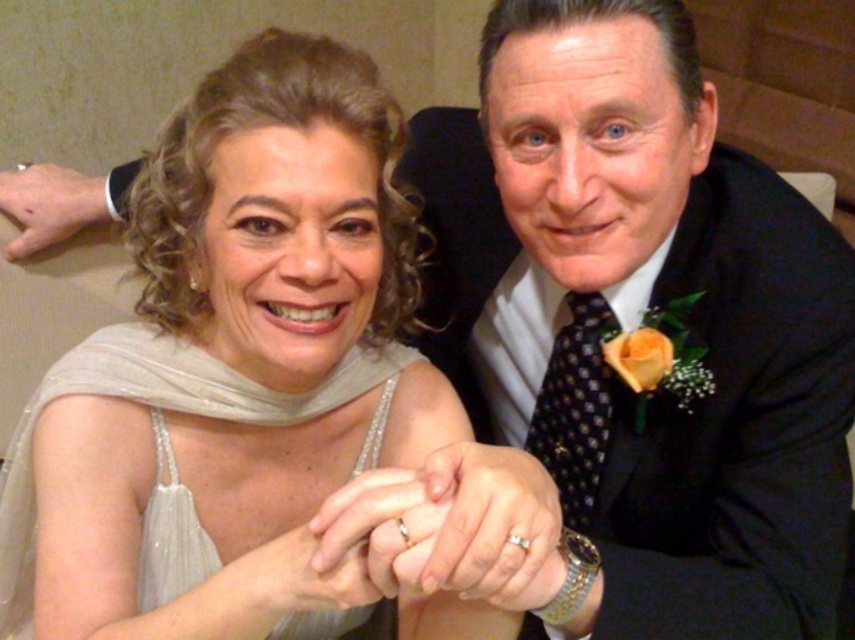
You are a photographer at a wedding and need to capture a closeup of the couple holding hands. The woman is on the left and the man is on the right. The point between their hands is at point (658, 128). If the distance between their hands is 25.97 inches, can you fit both their hands in a frame that is 24 inches wide?

The distance between their hands is 25.97 inches, which is wider than the 24 inch frame. Therefore, the frame is not wide enough to capture both hands.

You are a photographer at a wedding and need to adjust the lighting to highlight the black satin suit at upper right. Where should you position the light source relative to the subject?

The black satin suit at upper right is located at point (635, 326), so position the light source above and to the right of the subject to effectively illuminate the suit.

You are a photographer at a wedding and need to decide where to place a bouquet. The bouquet is 30 cm wide. You have two options for placement near the black satin suit at upper right and the satin white dress at center. Which location will allow the bouquet to fit better without overlapping the clothing?

The bouquet will fit better near the black satin suit at upper right because its width is less than the satin white dress at center, providing more space for the bouquet without overlapping.